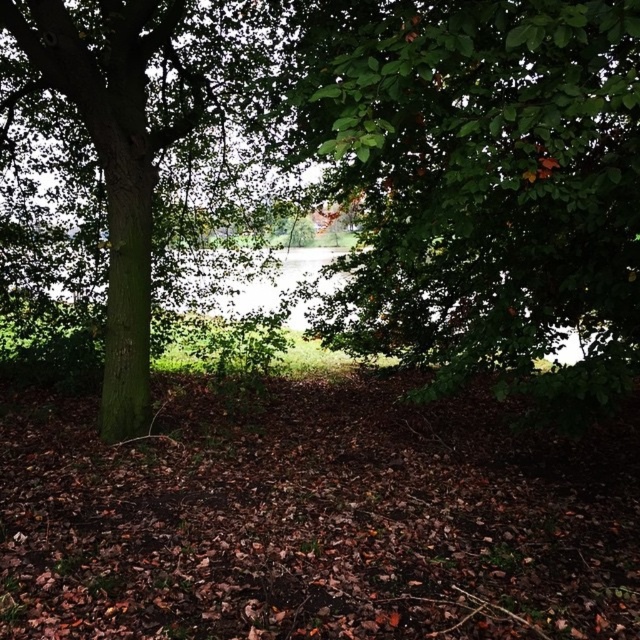
Question: Which point appears closest to the camera in this image?

Choices:
 (A) (109, 378)
 (B) (538, 115)

Answer: (B)

Question: Is green leafy tree at center thinner than green rough bark tree at left?

Choices:
 (A) no
 (B) yes

Answer: (A)

Question: Which object appears farthest from the camera in this image?

Choices:
 (A) green rough bark tree at left
 (B) green leafy tree at center

Answer: (A)

Question: From the image, what is the correct spatial relationship of green leafy tree at center in relation to green rough bark tree at left?

Choices:
 (A) right
 (B) left

Answer: (A)

Question: Does green leafy tree at center have a lesser width compared to green rough bark tree at left?

Choices:
 (A) no
 (B) yes

Answer: (A)